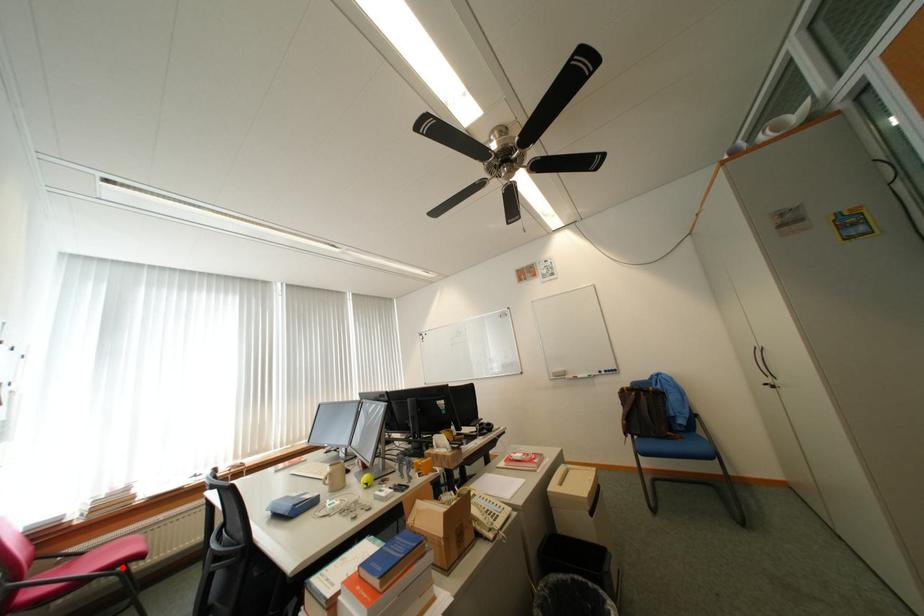
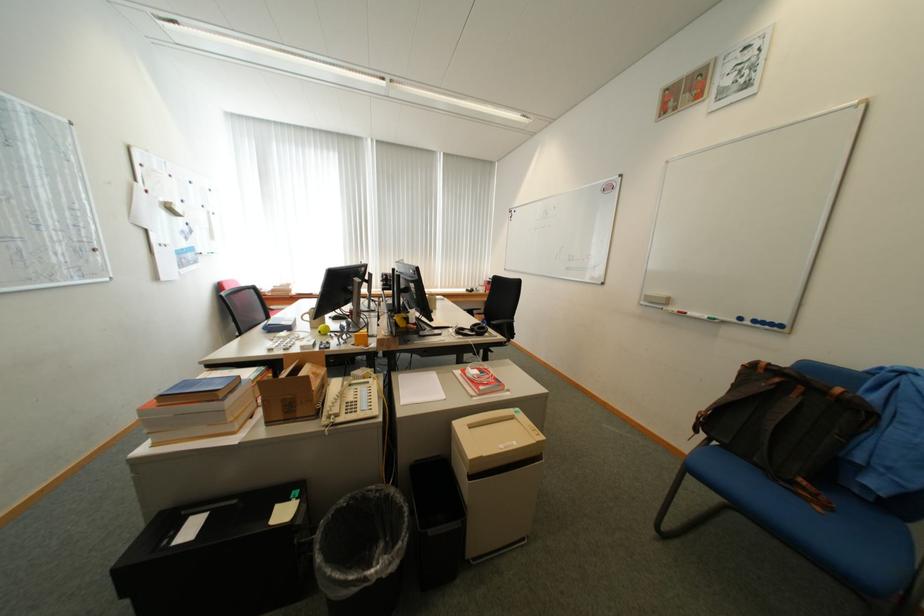
Question: I am providing you with two images of the same scene from different viewpoints. A red point is marked on the first image. Can you still see the location of the red point in image 2?

Choices:
 (A) Yes
 (B) No

Answer: (B)